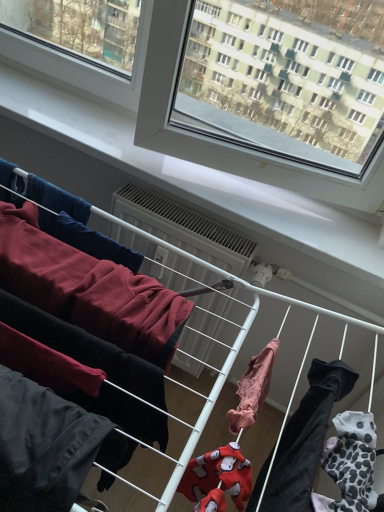
Question: Does light pink fabric at center, arranged as the third clothing when viewed from the left, contain dark red fleece sweatshirt at left, arranged as the second clothing when viewed from the left?

Choices:
 (A) no
 (B) yes

Answer: (A)

Question: Is light pink fabric at center, arranged as the third clothing when viewed from the left, looking in the opposite direction of dark red fleece sweatshirt at left, arranged as the second clothing when viewed from the left?

Choices:
 (A) yes
 (B) no

Answer: (B)

Question: From a real-world perspective, is light pink fabric at center, the first clothing viewed from the right, located beneath dark red fleece sweatshirt at left, which is the 2th clothing in right-to-left order?

Choices:
 (A) yes
 (B) no

Answer: (B)

Question: From the image's perspective, is light pink fabric at center, arranged as the third clothing when viewed from the left, on dark red fleece sweatshirt at left, arranged as the second clothing when viewed from the left?

Choices:
 (A) yes
 (B) no

Answer: (B)

Question: From the image's perspective, is light pink fabric at center, arranged as the third clothing when viewed from the left, beneath dark red fleece sweatshirt at left, which is the 2th clothing in right-to-left order?

Choices:
 (A) yes
 (B) no

Answer: (A)

Question: Is light pink fabric at center, the first clothing viewed from the right, placed right next to dark red fleece sweatshirt at left, arranged as the second clothing when viewed from the left?

Choices:
 (A) no
 (B) yes

Answer: (A)

Question: Would you consider light pink fabric at center, the first clothing viewed from the right, to be distant from white plastic air conditioner at center?

Choices:
 (A) no
 (B) yes

Answer: (A)

Question: Is light pink fabric at center, arranged as the third clothing when viewed from the left, positioned behind white plastic air conditioner at center?

Choices:
 (A) yes
 (B) no

Answer: (B)

Question: Can you confirm if light pink fabric at center, arranged as the third clothing when viewed from the left, is wider than white plastic air conditioner at center?

Choices:
 (A) no
 (B) yes

Answer: (B)

Question: Does light pink fabric at center, arranged as the third clothing when viewed from the left, come in front of white plastic air conditioner at center?

Choices:
 (A) yes
 (B) no

Answer: (A)

Question: Is light pink fabric at center, the first clothing viewed from the right, turned away from white plastic air conditioner at center?

Choices:
 (A) no
 (B) yes

Answer: (A)

Question: Can you confirm if light pink fabric at center, the first clothing viewed from the right, is shorter than white plastic air conditioner at center?

Choices:
 (A) yes
 (B) no

Answer: (A)

Question: From the image's perspective, is white plastic air conditioner at center below light pink fabric at center, arranged as the third clothing when viewed from the left?

Choices:
 (A) yes
 (B) no

Answer: (B)